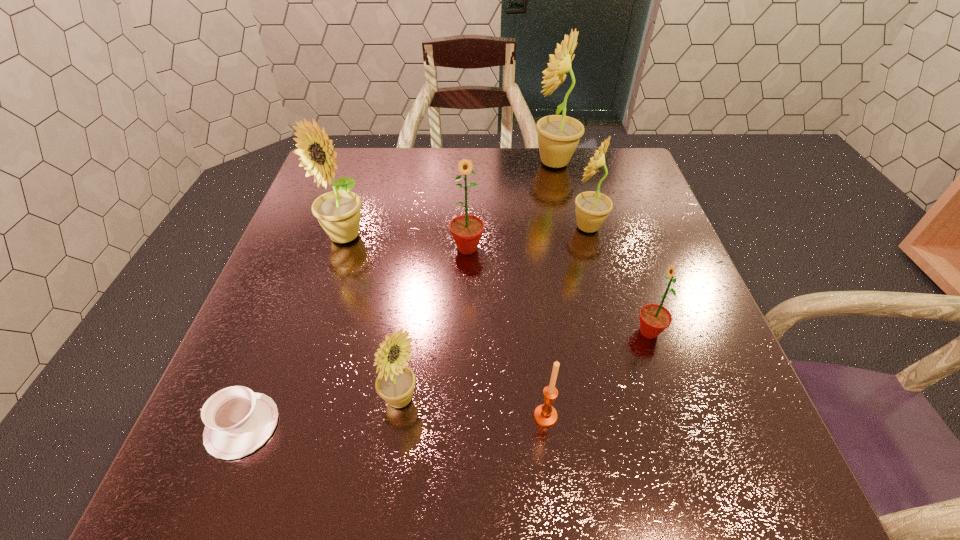
Locate an element on the screen. object at the near left corner is located at coordinates (238, 421).

Where is `free location at the far edge of the desktop`? The height and width of the screenshot is (540, 960). free location at the far edge of the desktop is located at coordinates (474, 154).

Locate an element on the screen. This screenshot has width=960, height=540. free space at the left edge of the desktop is located at coordinates (345, 243).

In the image, there is a desktop. Where is `free space at the right edge`? free space at the right edge is located at coordinates (708, 357).

The width and height of the screenshot is (960, 540). In the image, there is a desktop. What are the coordinates of `vacant space at the far left corner` in the screenshot? It's located at pos(358,159).

In order to click on vacant point at the far right corner in this screenshot , I will do 632,172.

Where is `free space between the third sunflower from left to right and the tallest sunflower`? free space between the third sunflower from left to right and the tallest sunflower is located at coordinates [511, 205].

At what (x,y) coordinates should I click in order to perform the action: click on empty space between the fourth nearest object and the bigger green sunflower. Please return your answer as a coordinate pair (x, y). The height and width of the screenshot is (540, 960). Looking at the image, I should click on (558, 290).

Locate an element on the screen. The height and width of the screenshot is (540, 960). empty space between the tallest object and the leftmost yellow sunflower is located at coordinates (449, 200).

Where is `free space between the farther green sunflower and the smaller green sunflower`? The image size is (960, 540). free space between the farther green sunflower and the smaller green sunflower is located at coordinates (558, 290).